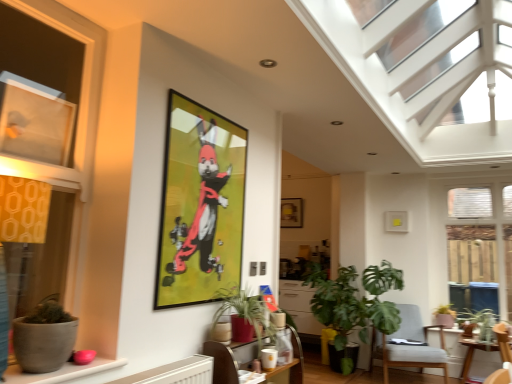
Question: Can matte glass window at left, which ranks as the 1th window in left-to-right order, be found inside matte gray pot at lower left, the third flowerpot positioned from the back?

Choices:
 (A) no
 (B) yes

Answer: (A)

Question: From the image's perspective, is matte gray pot at lower left, the third flowerpot positioned from the back, on top of matte glass window at left, positioned as the 2th window in front-to-back order?

Choices:
 (A) yes
 (B) no

Answer: (B)

Question: Is matte gray pot at lower left, marked as the 3th flowerpot in a right-to-left arrangement, to the right of matte glass window at left, the 3th window in the right-to-left sequence, from the viewer's perspective?

Choices:
 (A) yes
 (B) no

Answer: (A)

Question: Does matte gray pot at lower left, the third flowerpot positioned from the back, have a lesser height compared to matte glass window at left, the 2th window when ordered from back to front?

Choices:
 (A) yes
 (B) no

Answer: (A)

Question: From a real-world perspective, is matte gray pot at lower left, marked as the 1th flowerpot in a left-to-right arrangement, positioned over matte glass window at left, the 2th window when ordered from back to front, based on gravity?

Choices:
 (A) no
 (B) yes

Answer: (A)

Question: Is point (90, 172) positioned closer to the camera than point (35, 357)?

Choices:
 (A) farther
 (B) closer

Answer: (A)

Question: From the image's perspective, relative to matte gray pot at lower left, marked as the 1th flowerpot in a left-to-right arrangement, is matte glass window at left, which ranks as the 1th window in left-to-right order, above or below?

Choices:
 (A) below
 (B) above

Answer: (B)

Question: Looking at their shapes, would you say matte glass window at left, the 2th window when ordered from back to front, is wider or thinner than matte gray pot at lower left, the 1th flowerpot positioned from the top?

Choices:
 (A) thin
 (B) wide

Answer: (A)

Question: Is matte glass window at left, positioned as the 2th window in front-to-back order, bigger or smaller than matte gray pot at lower left, the 1th flowerpot positioned from the top?

Choices:
 (A) small
 (B) big

Answer: (B)

Question: Based on their sizes in the image, would you say light gray fabric chair at lower right is bigger or smaller than matte gray window sill at lower left?

Choices:
 (A) small
 (B) big

Answer: (B)

Question: Based on their positions, is light gray fabric chair at lower right located to the left or right of matte gray window sill at lower left?

Choices:
 (A) right
 (B) left

Answer: (A)

Question: In terms of width, does light gray fabric chair at lower right look wider or thinner when compared to matte gray window sill at lower left?

Choices:
 (A) wide
 (B) thin

Answer: (A)

Question: Is point (400, 326) positioned closer to the camera than point (59, 372)?

Choices:
 (A) farther
 (B) closer

Answer: (A)

Question: From the image's perspective, relative to metallic gold picture frame at upper center, the 2th picture frame in the right-to-left sequence, is matte ceramic pot at lower center, the second flowerpot viewed from the back, above or below?

Choices:
 (A) below
 (B) above

Answer: (A)

Question: Considering their positions, is matte ceramic pot at lower center, which is counted as the 2th flowerpot, starting from the bottom, located in front of or behind metallic gold picture frame at upper center, placed as the 2th picture frame when sorted from back to front?

Choices:
 (A) front
 (B) behind

Answer: (B)